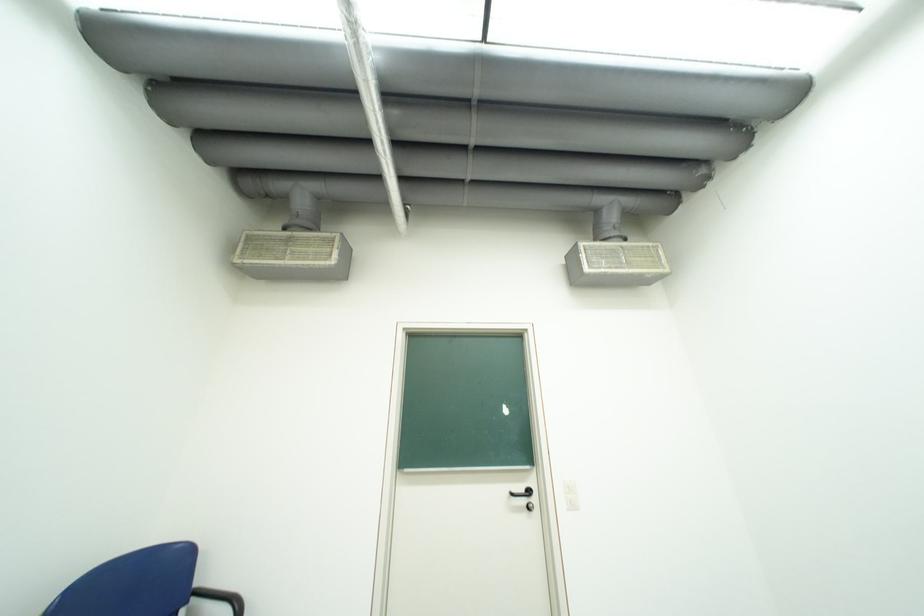
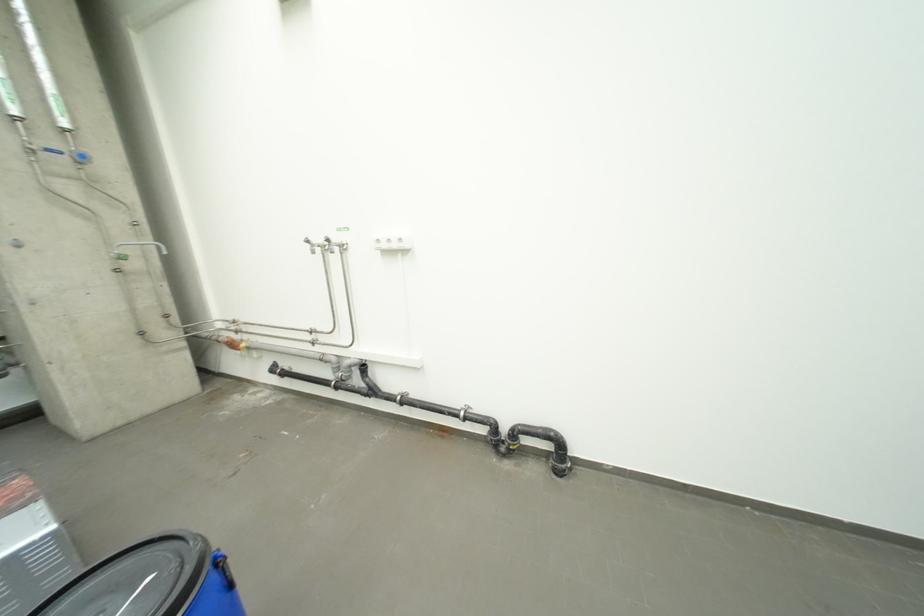
Question: How did the camera likely rotate?

Choices:
 (A) Left
 (B) Right
 (C) Up
 (D) Down

Answer: (A)